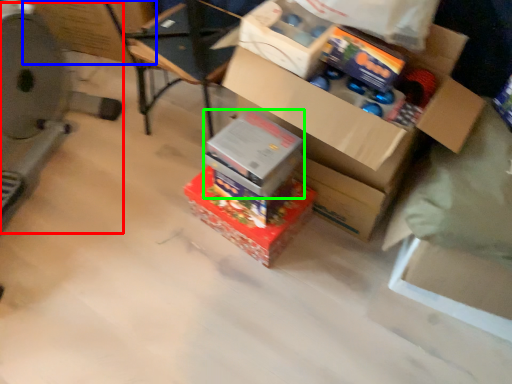
Question: Which is farther away from wide (highlighted by a red box)? cardboard box (highlighted by a blue box) or box (highlighted by a green box)?

Choices:
 (A) cardboard box
 (B) box

Answer: (B)